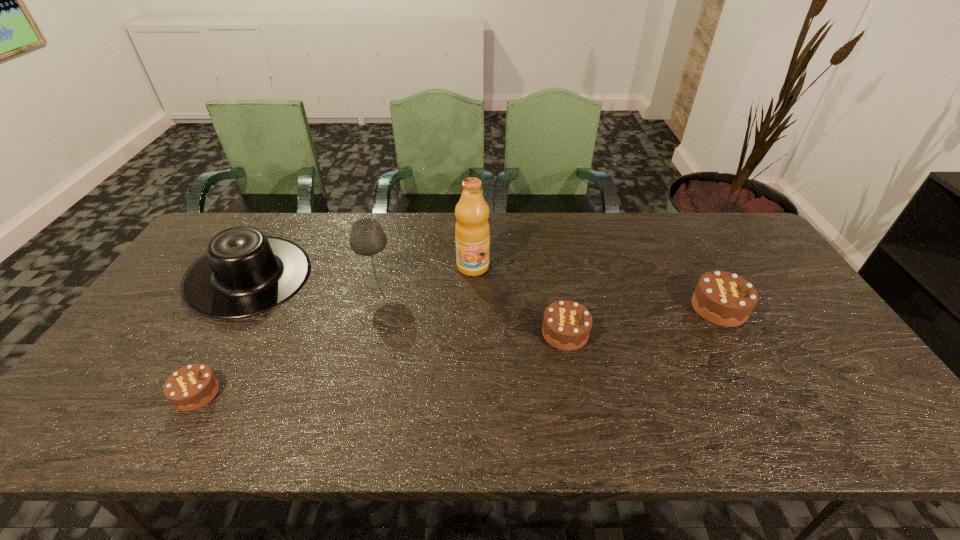
Locate an element on the screen. The width and height of the screenshot is (960, 540). the fifth shortest object is located at coordinates (367, 238).

The height and width of the screenshot is (540, 960). Find the location of `vacant region located 0.200m on the back of the shortest object`. vacant region located 0.200m on the back of the shortest object is located at coordinates (240, 315).

This screenshot has height=540, width=960. Find the location of `vacant space situated on the back of the second shortest chocolate cake`. vacant space situated on the back of the second shortest chocolate cake is located at coordinates (549, 247).

Locate an element on the screen. The width and height of the screenshot is (960, 540). free location located 0.230m on the back of the rightmost object is located at coordinates (682, 242).

At what (x,y) coordinates should I click in order to perform the action: click on vacant space located 0.330m on the front label of the tallest object. Please return your answer as a coordinate pair (x, y). Image resolution: width=960 pixels, height=540 pixels. Looking at the image, I should click on (471, 367).

Where is `vacant area situated 0.160m on the front of the fourth shortest object`? vacant area situated 0.160m on the front of the fourth shortest object is located at coordinates (196, 369).

At what (x,y) coordinates should I click in order to perform the action: click on free location located 0.150m on the left of the wineglass. Please return your answer as a coordinate pair (x, y). This screenshot has width=960, height=540. Looking at the image, I should click on (310, 281).

Locate an element on the screen. object that is positioned at the far edge is located at coordinates tap(243, 273).

Locate an element on the screen. The image size is (960, 540). object positioned at the near edge is located at coordinates click(191, 387).

Where is `object that is positioned at the left edge`? The image size is (960, 540). object that is positioned at the left edge is located at coordinates (243, 273).